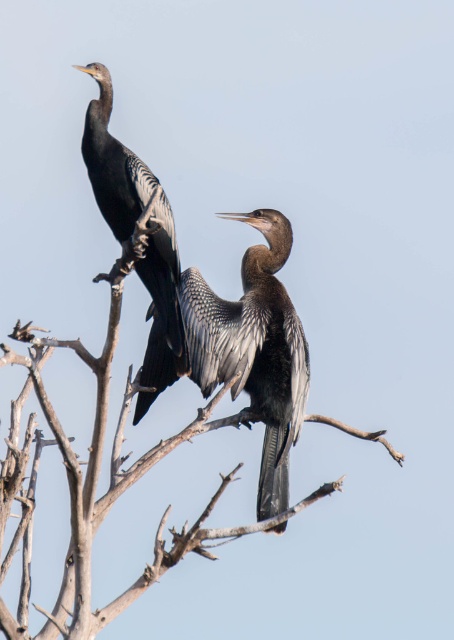
Question: Which point is closer to the camera?

Choices:
 (A) (217, 296)
 (B) (92, 113)
 (C) (210, 388)

Answer: (B)

Question: Is brown wood tree at center to the right of dark gray feathers at center from the viewer's perspective?

Choices:
 (A) yes
 (B) no

Answer: (B)

Question: Among these objects, which one is nearest to the camera?

Choices:
 (A) dark gray feathers at center
 (B) shiny black bird at left
 (C) brown wood tree at center

Answer: (C)

Question: Is dark gray feathers at center thinner than shiny black bird at left?

Choices:
 (A) yes
 (B) no

Answer: (B)

Question: Does brown wood tree at center have a lesser width compared to shiny black bird at left?

Choices:
 (A) no
 (B) yes

Answer: (B)

Question: Which object is closer to the camera taking this photo?

Choices:
 (A) brown wood tree at center
 (B) dark gray feathers at center
 (C) shiny black bird at left

Answer: (A)